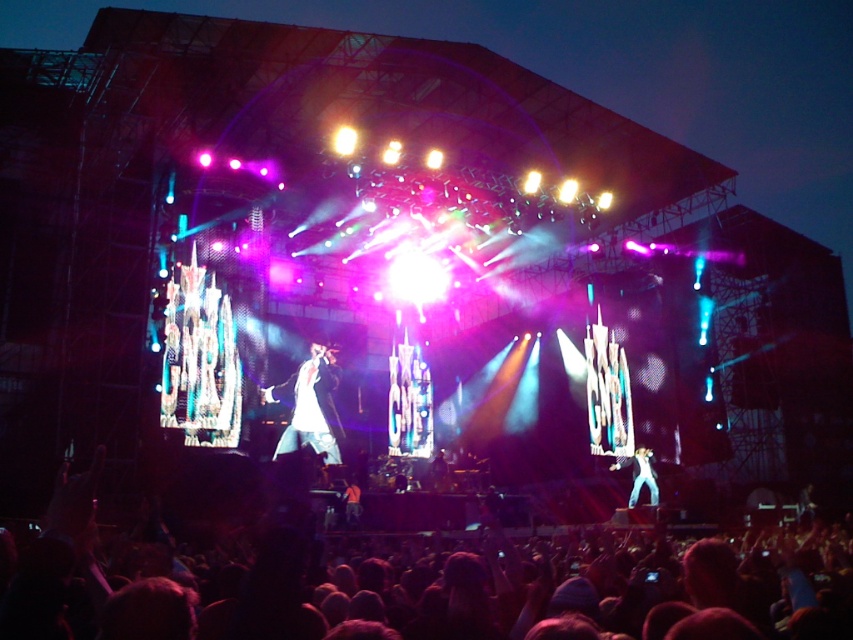
Question: Can you confirm if white glossy suit at center is smaller than white cotton shirt at center?

Choices:
 (A) no
 (B) yes

Answer: (A)

Question: Which point is farther to the camera?

Choices:
 (A) pos(270,394)
 (B) pos(651,452)

Answer: (B)

Question: Among these points, which one is nearest to the camera?

Choices:
 (A) (270, 396)
 (B) (631, 456)

Answer: (A)

Question: Which object appears closest to the camera in this image?

Choices:
 (A) white glossy suit at center
 (B) white cotton shirt at center

Answer: (A)

Question: Is white glossy suit at center positioned at the back of white cotton shirt at center?

Choices:
 (A) no
 (B) yes

Answer: (A)

Question: Can you confirm if white glossy suit at center is positioned below white cotton shirt at center?

Choices:
 (A) yes
 (B) no

Answer: (B)